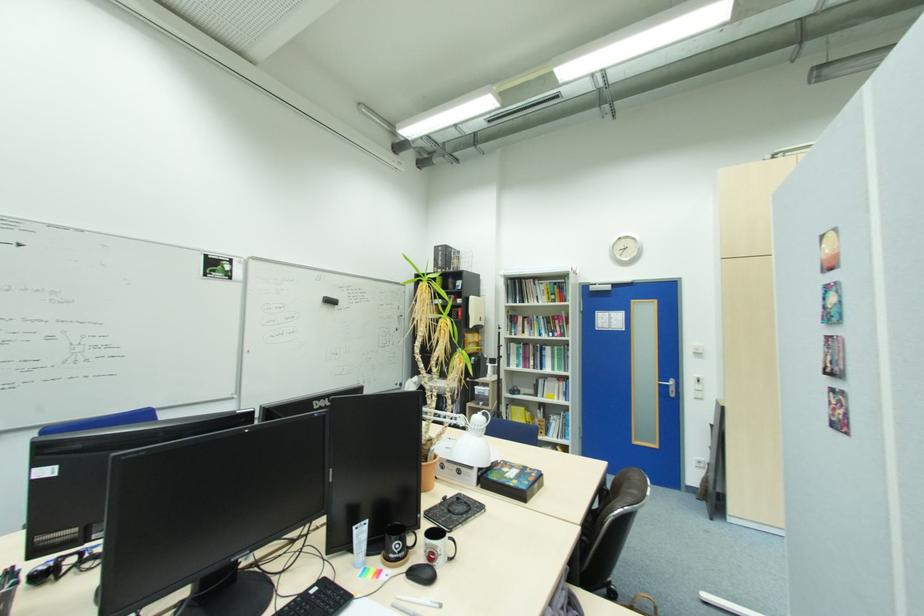
Find where to push the white light switch. Please return your answer as a coordinate pair (x, y).

(698, 387)